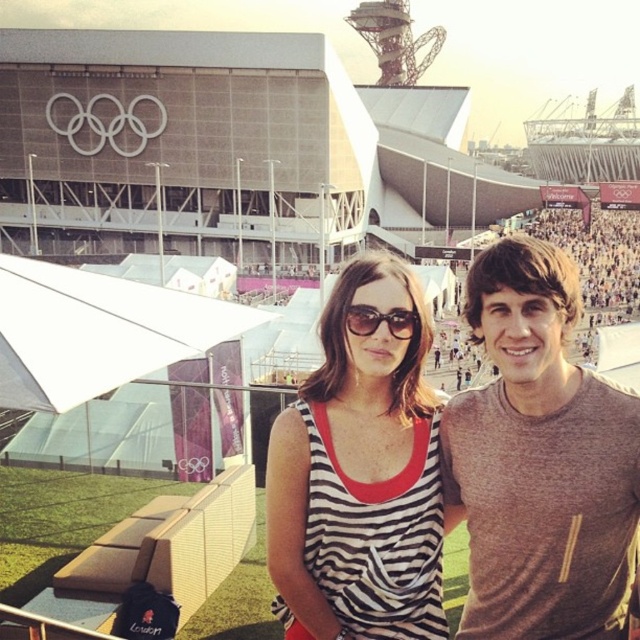
You are a photographer trying to capture a closeup shot of the sunglasses at center. The striped fabric tank top at center is blocking your view. Can you move the tank top to the side to get a clear shot of the sunglasses?

The striped fabric tank top at center has a larger size compared to sunglasses at center. Since the tank top is larger, it might block more of the view, so moving it aside could help get a clear shot of the sunglasses at center.

You are standing at the Olympic Park in London and want to take a photo of the Olympic rings displayed on the modern building. The camera you are using has a maximum zoom range of 100 feet. Is the point where the Olympic rings are located, which is at coordinate point (516,237), within the camera range?

The point (516,237) is 105.48 feet away from the camera, which exceeds the maximum zoom range of 100 feet. Therefore, the Olympic rings at point (516,237) are out of the camera range.

You are a photographer trying to capture a candid shot of the two people in front of the Olympic Park building. Your camera has a maximum focus range of 3 meters. Can you focus on both the striped fabric tank top at center and the sunglasses at center at the same time?

The striped fabric tank top at center is 3.80 meters from the sunglasses at center. Since the distance between them exceeds the camera maximum focus range of 3 meters, you cannot focus on both at the same time.